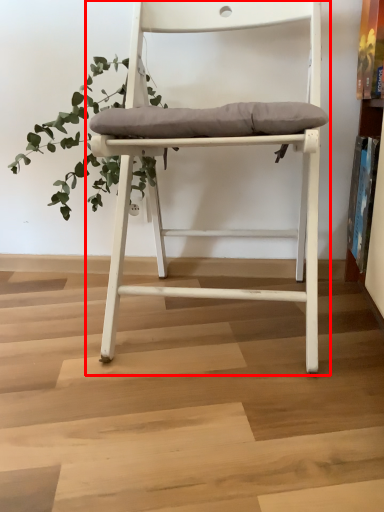
Question: From the image's perspective, what is the correct spatial positioning of chair (annotated by the red box) in reference to vegetation?

Choices:
 (A) below
 (B) above

Answer: (A)